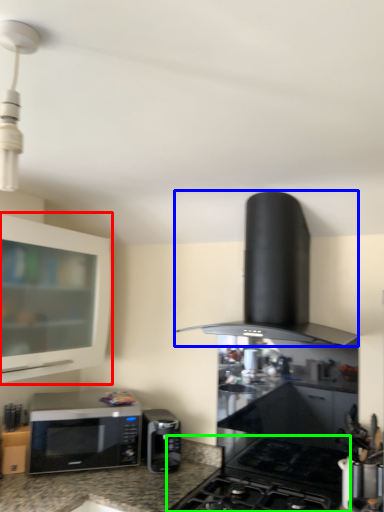
Question: Considering the real-world distances, which object is farthest from cabinetry (highlighted by a red box)? kitchen appliance (highlighted by a blue box) or gas stove (highlighted by a green box)?

Choices:
 (A) kitchen appliance
 (B) gas stove

Answer: (B)